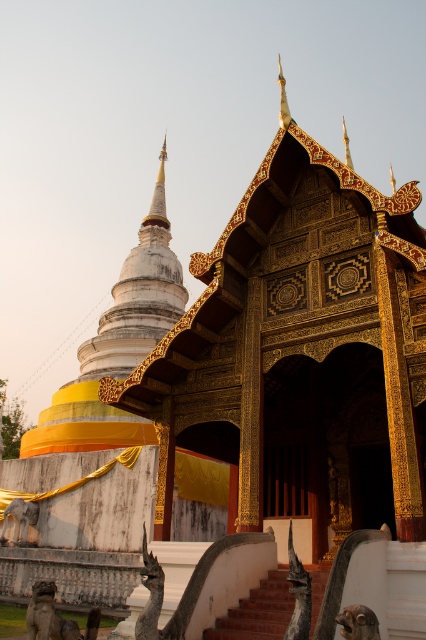
You are a visitor at the temple and want to take a photo of the entrance. You notice the terracotta brick stairs at center and the smooth stone dog at lower left. Which object is shorter in height?

The terracotta brick stairs at center is not as tall as the smooth stone dog at lower left, so the terracotta brick stairs at center is shorter in height.

You are an architect planning to install a decorative banner between the two objects. The banner requires a distance of at least 30 meters between the two points to be properly displayed. Based on the scene, will the distance between the terracotta brick stairs at center and the decorative stone lion statues at the base be sufficient for the banner?

The terracotta brick stairs at center and the decorative stone lion statues at the base are 29.27 meters apart, which is less than the required 30 meters. Therefore, the distance is insufficient for the banner.